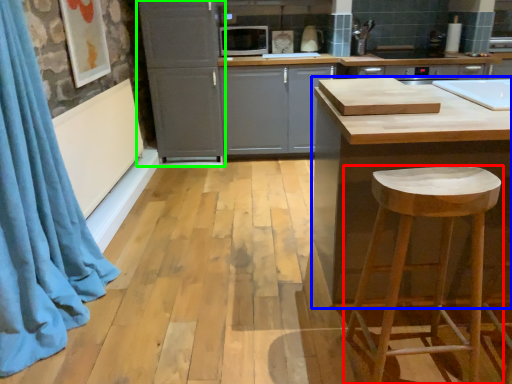
Question: Which object is positioned closest to stool (highlighted by a red box)? Select from countertop (highlighted by a blue box) and cabinetry (highlighted by a green box).

Choices:
 (A) countertop
 (B) cabinetry

Answer: (A)